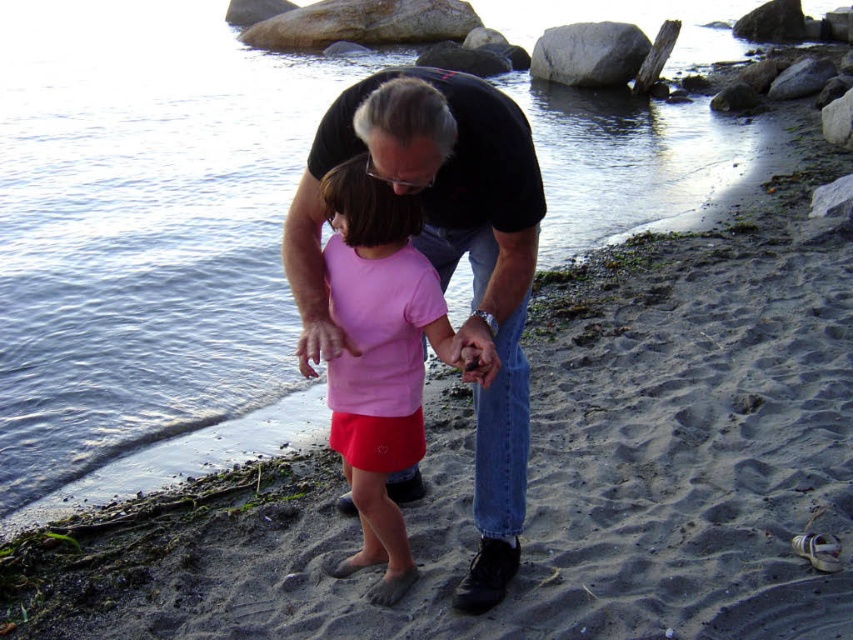
Question: Which object appears closest to the camera in this image?

Choices:
 (A) smooth gray rock at upper center
 (B) pink matte shirt at center

Answer: (B)

Question: Is pink matte shirt at center behind smooth gray rock at upper center?

Choices:
 (A) no
 (B) yes

Answer: (A)

Question: Is pink matte shirt at center positioned behind smooth gray rock at upper center?

Choices:
 (A) no
 (B) yes

Answer: (A)

Question: Can you confirm if pink matte shirt at center is thinner than smooth gray rock at upper center?

Choices:
 (A) no
 (B) yes

Answer: (B)